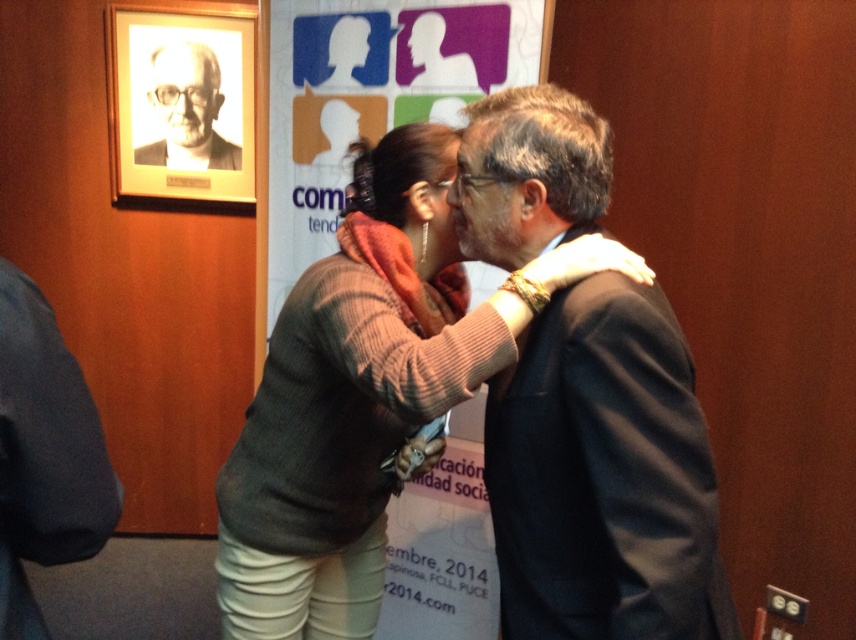
Question: Can you confirm if dark gray suit at left is positioned to the left of matte black suit at center?

Choices:
 (A) no
 (B) yes

Answer: (B)

Question: Does dark gray sweater at center appear on the right side of dark gray suit at left?

Choices:
 (A) yes
 (B) no

Answer: (A)

Question: Does dark gray sweater at center have a greater width compared to matte black suit at center?

Choices:
 (A) yes
 (B) no

Answer: (A)

Question: Which point appears farthest from the camera in this image?

Choices:
 (A) (27, 509)
 (B) (541, 548)
 (C) (450, 164)
 (D) (290, 410)

Answer: (C)

Question: Which point appears farthest from the camera in this image?

Choices:
 (A) (159, 81)
 (B) (201, 84)
 (C) (426, 252)
 (D) (313, 524)

Answer: (B)

Question: Which of the following is the closest to the observer?

Choices:
 (A) (474, 150)
 (B) (294, 316)
 (C) (420, 204)

Answer: (A)